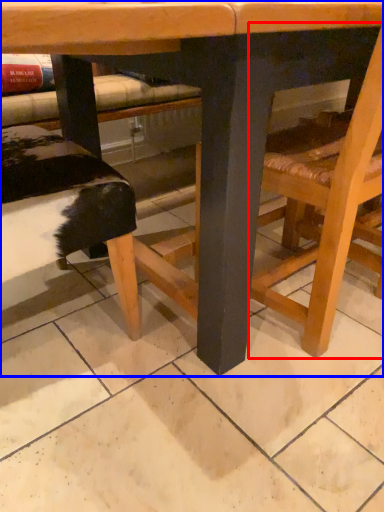
Question: Which point is closer to the camera, chair (highlighted by a red box) or table (highlighted by a blue box)?

Choices:
 (A) chair
 (B) table

Answer: (B)